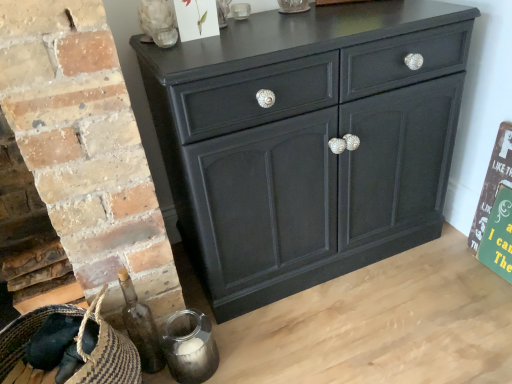
You are a GUI agent. You are given a task and a screenshot of the screen. Output one action in this format:
    pyautogui.click(x=<x>, y=<y>)
    Task: Click on the free spot in front of transparent glass skull at upper left
    
    Given the screenshot: What is the action you would take?
    pyautogui.click(x=178, y=47)